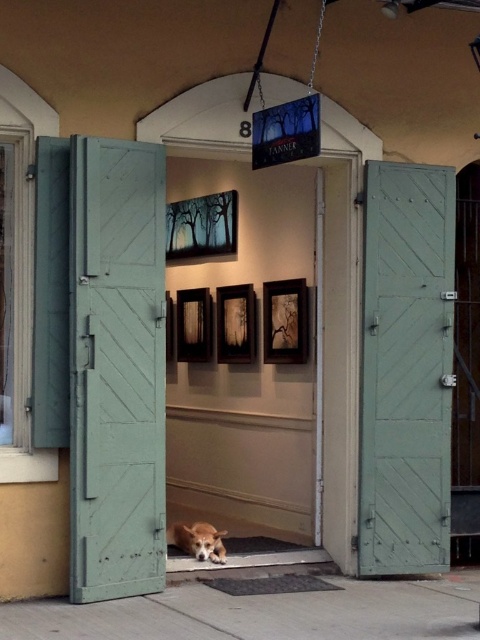
Is point (96, 256) in front of point (168, 536)?

That is True.

Can you confirm if teal wood door at left is wider than brown fur dog at center?

Yes, teal wood door at left is wider than brown fur dog at center.

Which is behind, point (164, 180) or point (189, 531)?

The point (189, 531) is behind.

At what (x,y) coordinates should I click in order to perform the action: click on teal wood door at left. Please return your answer as a coordinate pair (x, y). This screenshot has height=640, width=480. Looking at the image, I should click on 117,369.

Can you confirm if green wood door at right is positioned to the left of brown fur dog at center?

Incorrect, green wood door at right is not on the left side of brown fur dog at center.

Does point (444, 234) come farther from viewer compared to point (201, 545)?

Yes.

This screenshot has width=480, height=640. What do you see at coordinates (406, 369) in the screenshot? I see `green wood door at right` at bounding box center [406, 369].

What are the coordinates of `green wood door at right` in the screenshot? It's located at (406, 369).

Which is behind, point (112, 512) or point (372, 440)?

The point (372, 440) is behind.

Who is more forward, [79,294] or [454,202]?

Point [79,294] is in front.

Identify the location of teal wood door at left. This screenshot has height=640, width=480. (117, 369).

Locate an element on the screen. This screenshot has width=480, height=640. teal wood door at left is located at coordinates (117, 369).